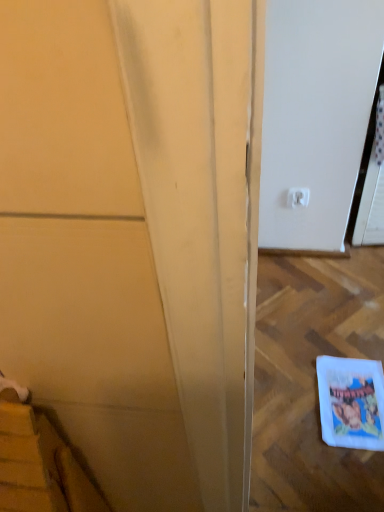
Question: Is matte yellow door at left to the left or to the right of white plastic electric outlet at upper right in the image?

Choices:
 (A) right
 (B) left

Answer: (B)

Question: Looking at their shapes, would you say matte yellow door at left is wider or thinner than white plastic electric outlet at upper right?

Choices:
 (A) wide
 (B) thin

Answer: (A)

Question: Which object is the farthest from the white plastic electric outlet at upper right?

Choices:
 (A) white paper comic book at lower right
 (B) matte yellow door at left

Answer: (B)

Question: Which object is the farthest from the matte yellow door at left?

Choices:
 (A) white plastic electric outlet at upper right
 (B) white paper comic book at lower right

Answer: (A)